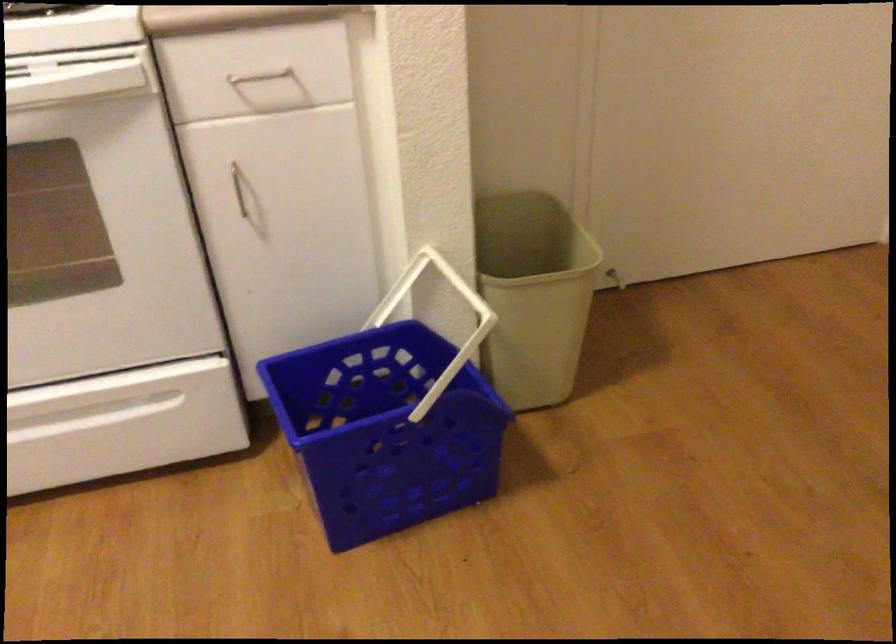
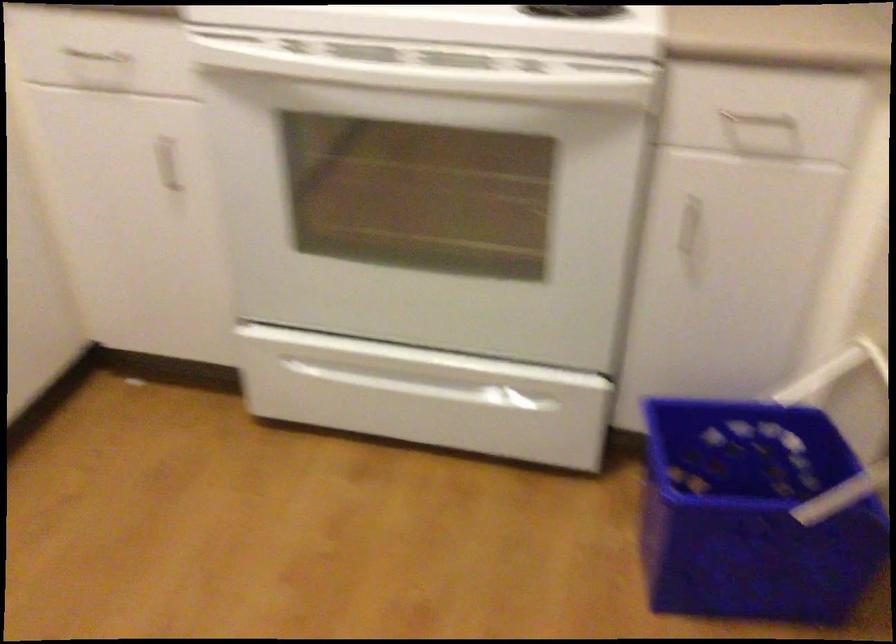
Locate, in the second image, the point that corresponds to pixel 251 196 in the first image.

(691, 228)